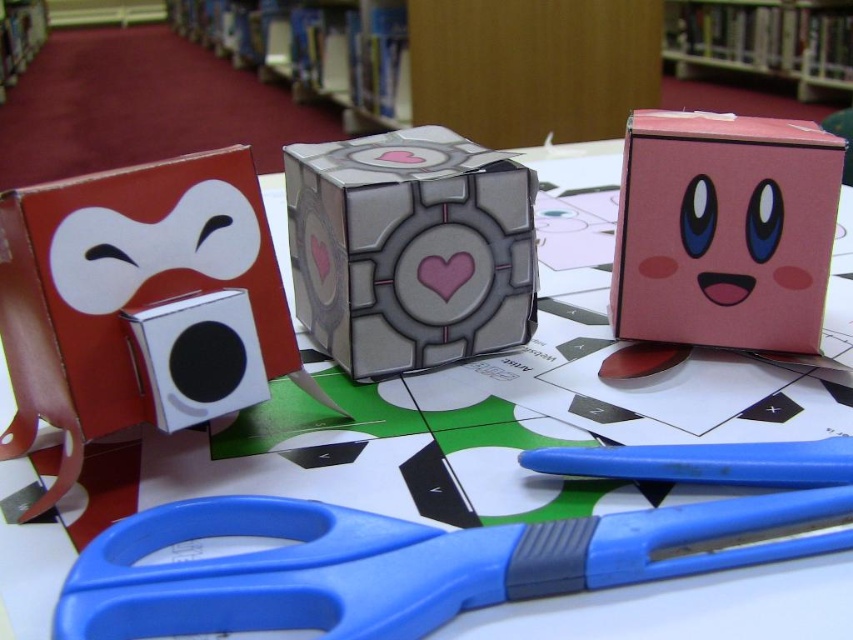
Question: Is white matte square at left to the left of pink matte box at center right from the viewer's perspective?

Choices:
 (A) yes
 (B) no

Answer: (A)

Question: Is metallic gray cube at center bigger than pink matte box at center right?

Choices:
 (A) yes
 (B) no

Answer: (A)

Question: Which object appears farthest from the camera in this image?

Choices:
 (A) metallic gray cube at center
 (B) wooden bookshelf at upper center

Answer: (B)

Question: Does blue plastic scissors at lower center have a lesser width compared to wooden bookshelf at upper center?

Choices:
 (A) no
 (B) yes

Answer: (B)

Question: Which of the following is the farthest from the observer?

Choices:
 (A) white matte square at left
 (B) wooden bookshelf at upper center
 (C) blue plastic scissors at lower center

Answer: (B)

Question: Which point is farther to the camera?

Choices:
 (A) (459, 257)
 (B) (837, 182)
 (C) (316, 566)

Answer: (A)